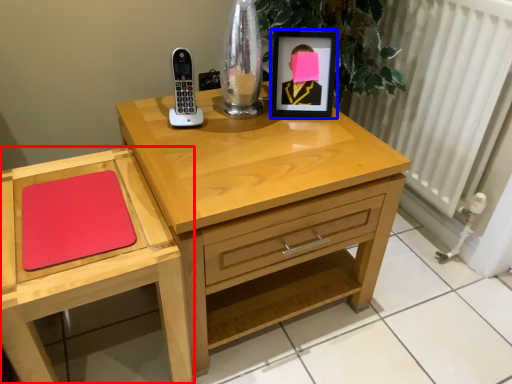
Question: Which of the following is the farthest to the observer, chest of drawers (highlighted by a red box) or picture frame (highlighted by a blue box)?

Choices:
 (A) chest of drawers
 (B) picture frame

Answer: (B)